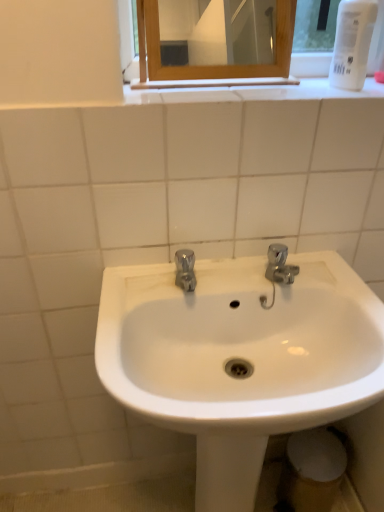
Where is `spots to the right of polished chrome faucet at center`? This screenshot has width=384, height=512. spots to the right of polished chrome faucet at center is located at coordinates (241, 281).